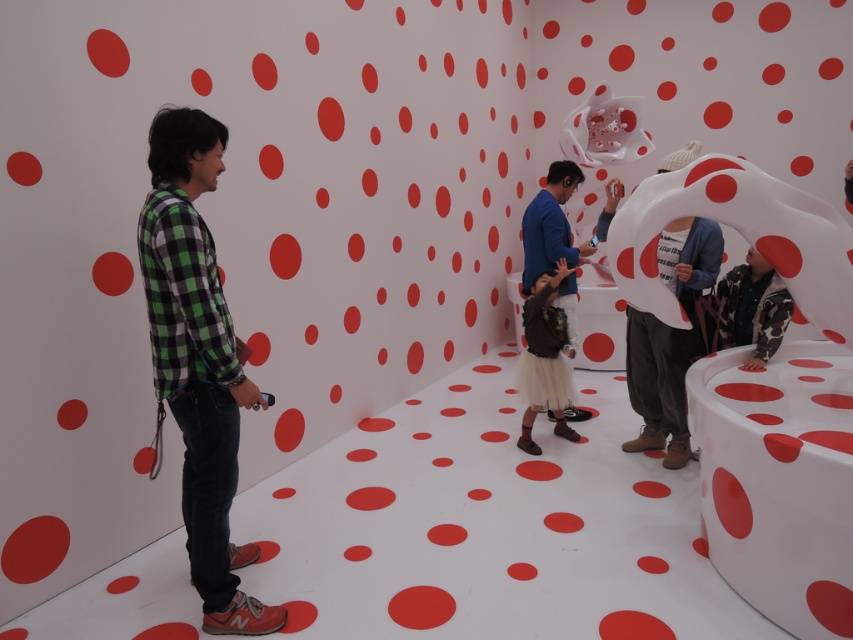
Is point (212, 476) more distant than point (612, 196)?

No, (212, 476) is closer to viewer.

Which of these two, green checkered shirt at left or brown leather jacket at center, stands taller?

green checkered shirt at left is taller.

Find the location of a particular element. The width and height of the screenshot is (853, 640). green checkered shirt at left is located at coordinates point(196,360).

At what (x,y) coordinates should I click in order to perform the action: click on green checkered shirt at left. Please return your answer as a coordinate pair (x, y). This screenshot has width=853, height=640. Looking at the image, I should click on (196, 360).

From the picture: Which is below, brown fabric skirt at center or brown leather jacket at center?

brown fabric skirt at center is lower down.

Between brown fabric skirt at center and brown leather jacket at center, which one has more height?

With more height is brown leather jacket at center.

Where is `brown fabric skirt at center`? Image resolution: width=853 pixels, height=640 pixels. brown fabric skirt at center is located at coordinates (544, 356).

Is point (233, 394) closer to viewer compared to point (628, 444)?

Yes, it is in front of point (628, 444).

Between green checkered shirt at left and white matte sculpture at center, which one has more height?

green checkered shirt at left is taller.

This screenshot has width=853, height=640. In order to click on green checkered shirt at left in this screenshot , I will do `click(196, 360)`.